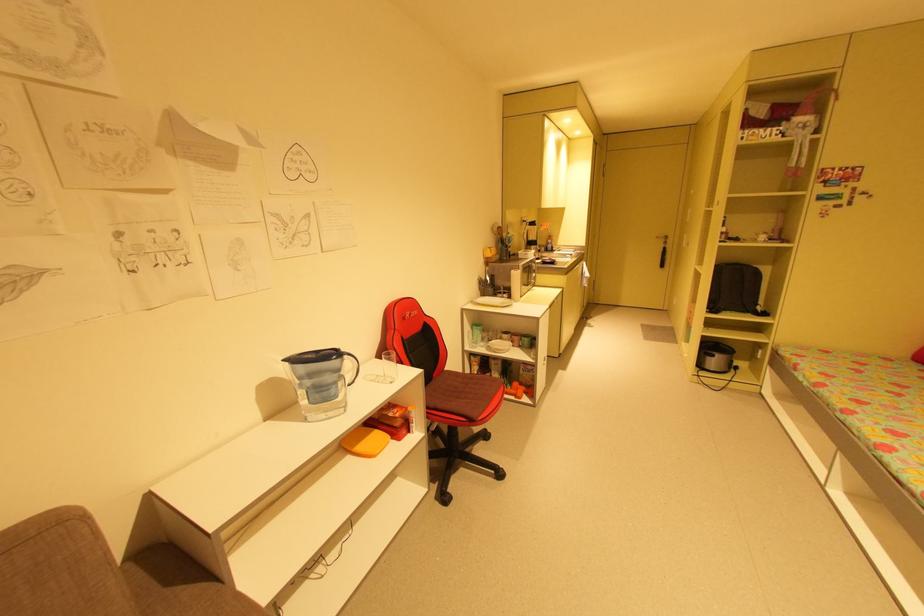
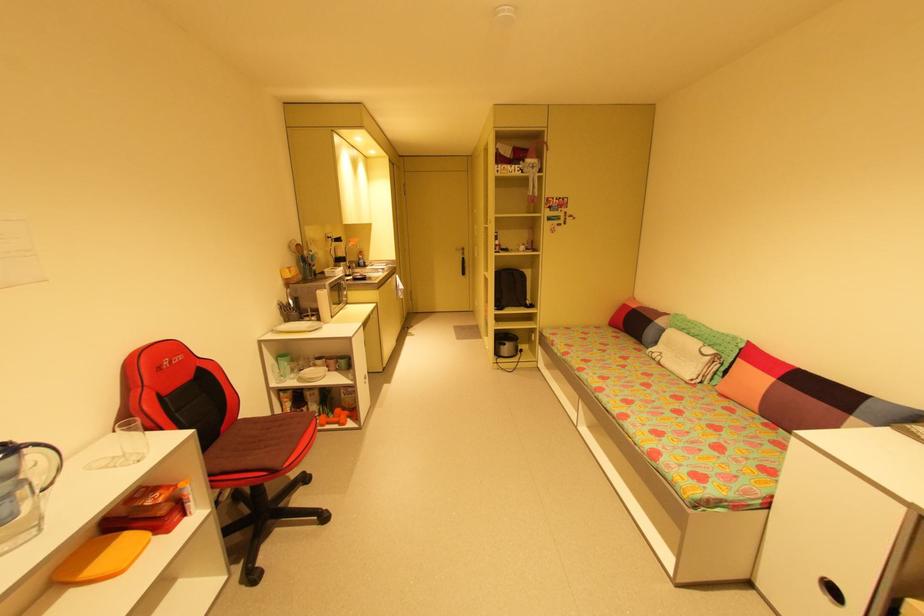
The point at (348, 357) is marked in the first image. Where is the corresponding point in the second image?

(30, 450)